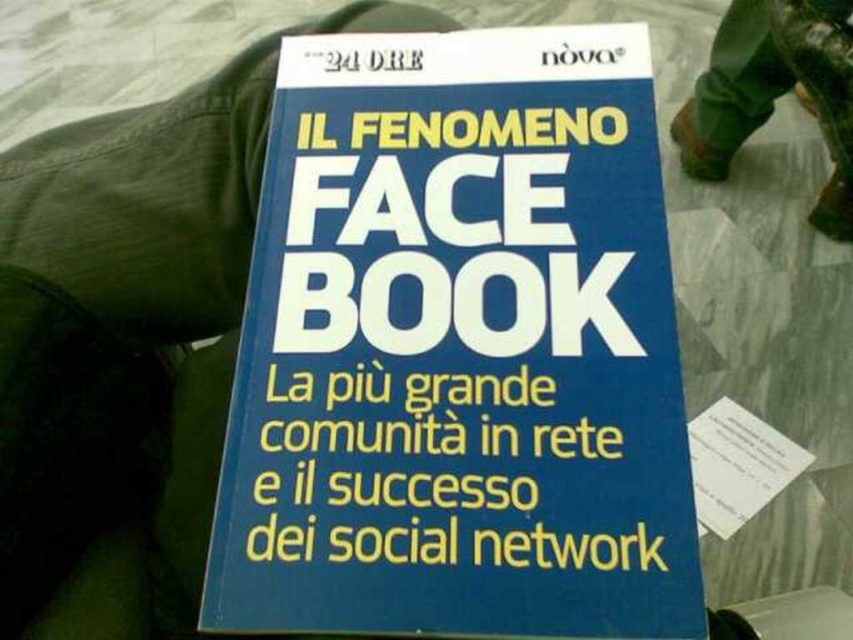
Question: Which point is farther to the camera?

Choices:
 (A) (9, 580)
 (B) (526, 595)

Answer: (A)

Question: Does blue paper book at center appear on the left side of green fabric at upper left?

Choices:
 (A) yes
 (B) no

Answer: (B)

Question: Which point is farther from the camera taking this photo?

Choices:
 (A) (287, 180)
 (B) (3, 294)

Answer: (A)

Question: Is green fabric at upper left bigger than camouflage fabric pants at upper right?

Choices:
 (A) no
 (B) yes

Answer: (A)

Question: Which object is closer to the camera taking this photo?

Choices:
 (A) blue paper book at center
 (B) green fabric at upper left
 (C) camouflage fabric pants at upper right

Answer: (A)

Question: Is green fabric at upper left behind camouflage fabric pants at upper right?

Choices:
 (A) no
 (B) yes

Answer: (A)